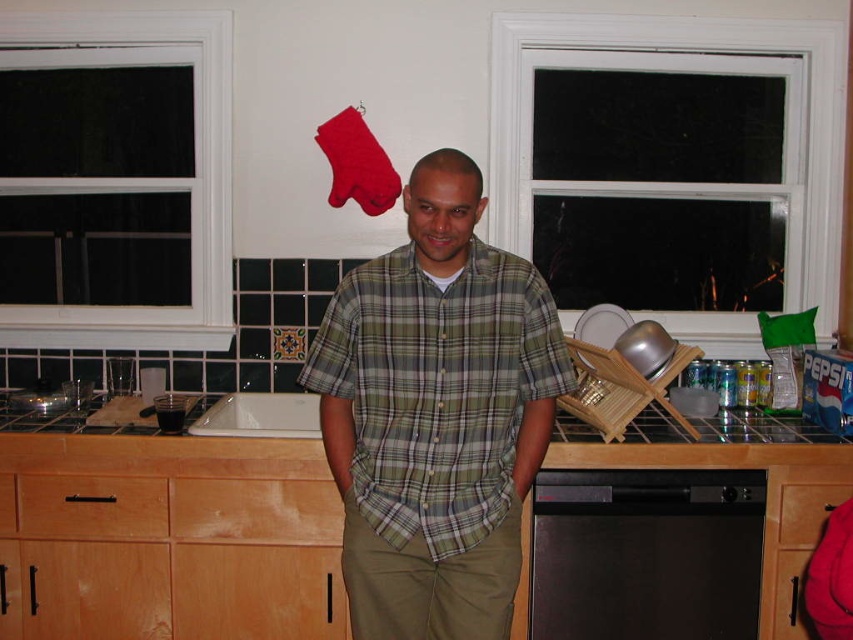
You are a delivery robot that is 1.5 meters tall. You are in the kitchen and need to place a package on the light brown wood drawer at lower center. Can you reach it?

The light brown wood drawer at lower center is 2.22 meters away from the camera, so the robot cannot reach it since it is further away than the robot can extend its arm.

You are organizing the kitchen and need to place a new appliance. The wooden at center and the light brown wood drawer at lower center are in your way. Which one should you move to make space?

The wooden at center is located below the light brown wood drawer at lower center, so you should move the light brown wood drawer at lower center to make space.